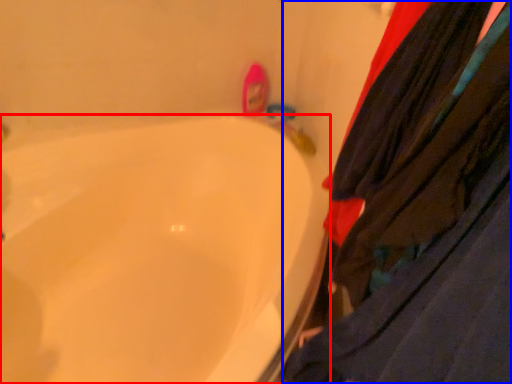
Question: Which object is closer to the camera taking this photo, bathtub (highlighted by a red box) or clothing (highlighted by a blue box)?

Choices:
 (A) bathtub
 (B) clothing

Answer: (B)